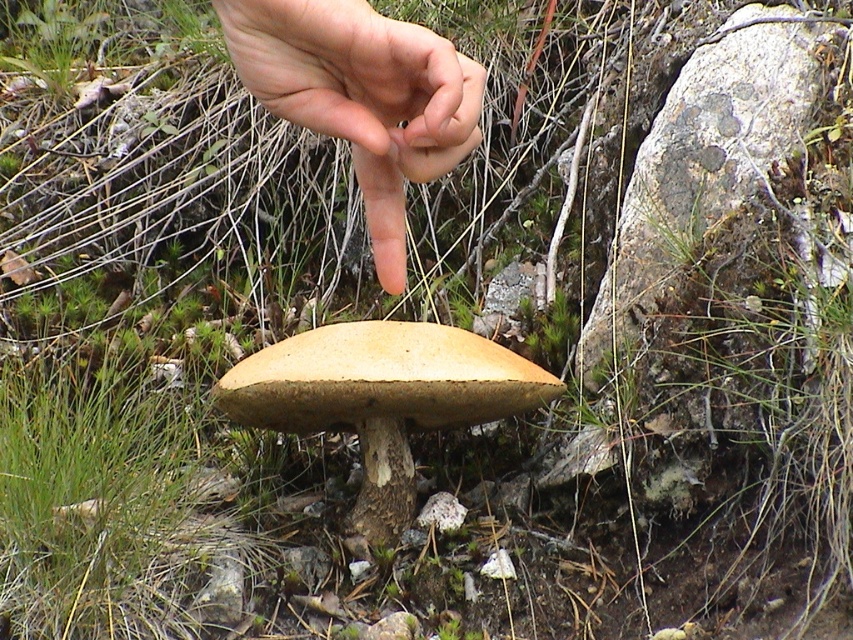
Question: Is skinny flesh at center behind light brown wood at center?

Choices:
 (A) no
 (B) yes

Answer: (A)

Question: Can you confirm if skinny flesh at center is smaller than light brown wood at center?

Choices:
 (A) no
 (B) yes

Answer: (B)

Question: Can you confirm if skinny flesh at center is smaller than light brown wood at center?

Choices:
 (A) yes
 (B) no

Answer: (A)

Question: Among these objects, which one is farthest from the camera?

Choices:
 (A) light brown wood at center
 (B) skinny flesh at center

Answer: (A)